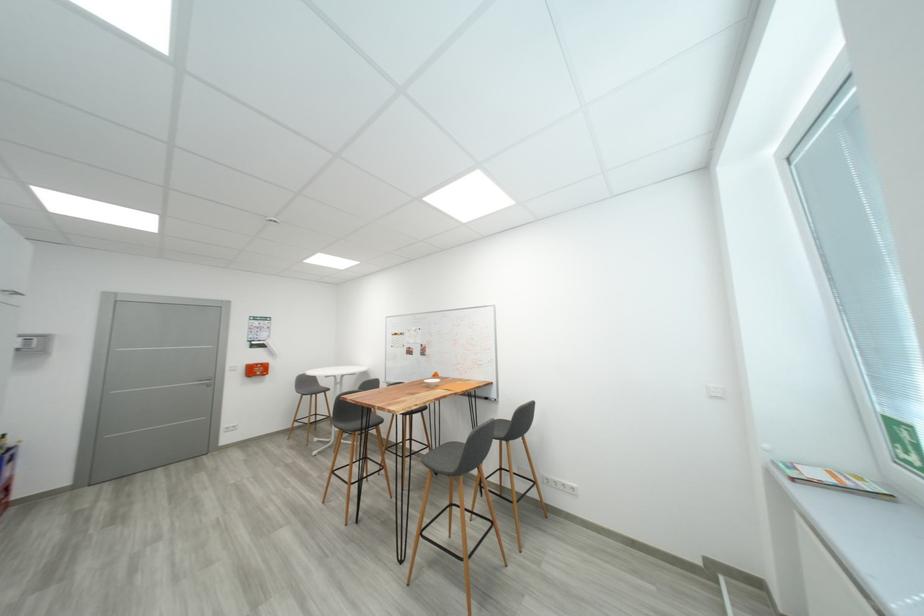
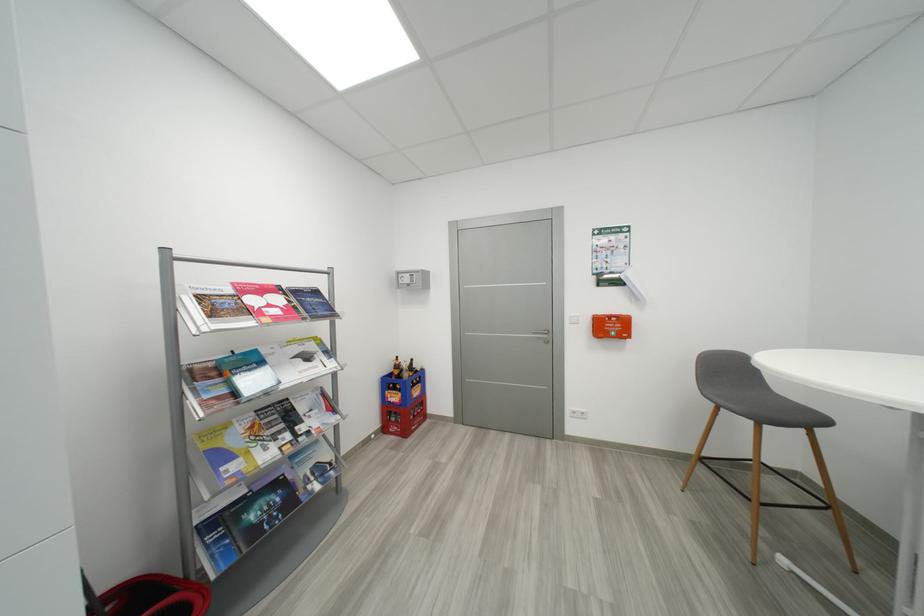
Locate, in the second image, the point that corresponds to [263,373] in the first image.

(617, 330)